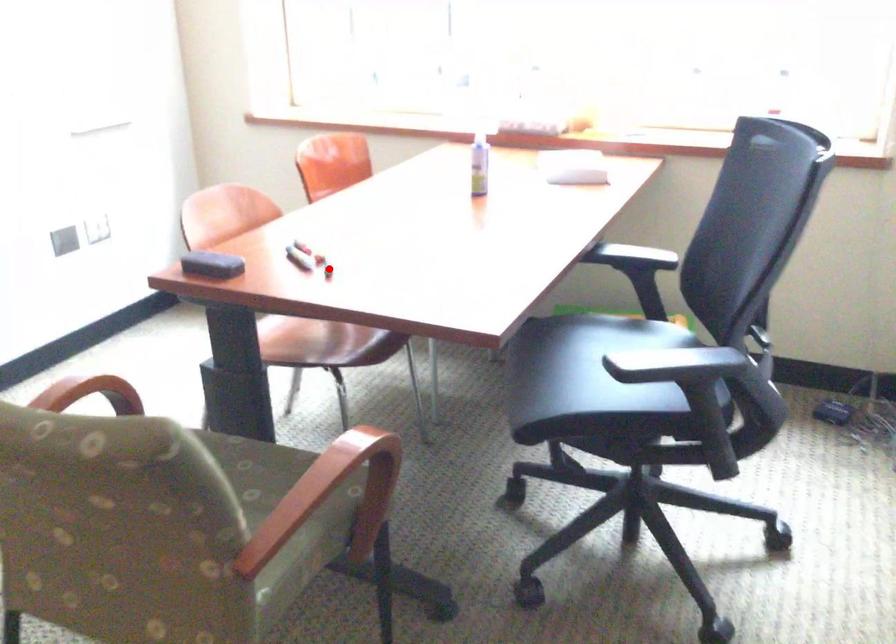
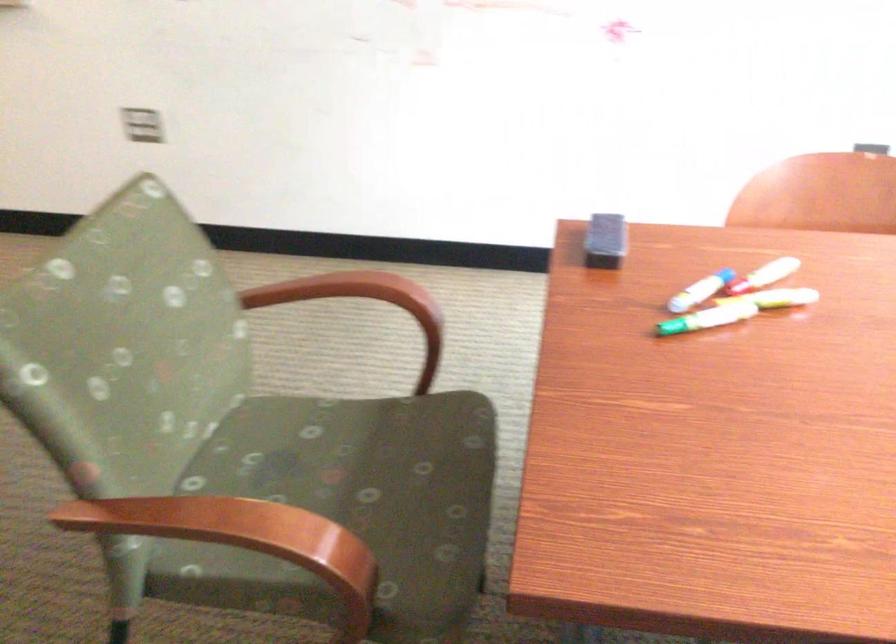
Question: I am providing you with two images of the same scene from different viewpoints. Given a red point in image1, look at the same physical point in image2. Is it:

Choices:
 (A) Closer to the viewpoint
 (B) Farther from the viewpoint

Answer: (A)